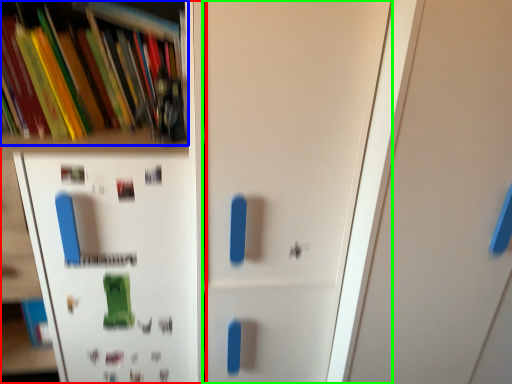
Question: Which is farther away from shelf (highlighted by a red box)? book (highlighted by a blue box) or door (highlighted by a green box)?

Choices:
 (A) book
 (B) door

Answer: (B)